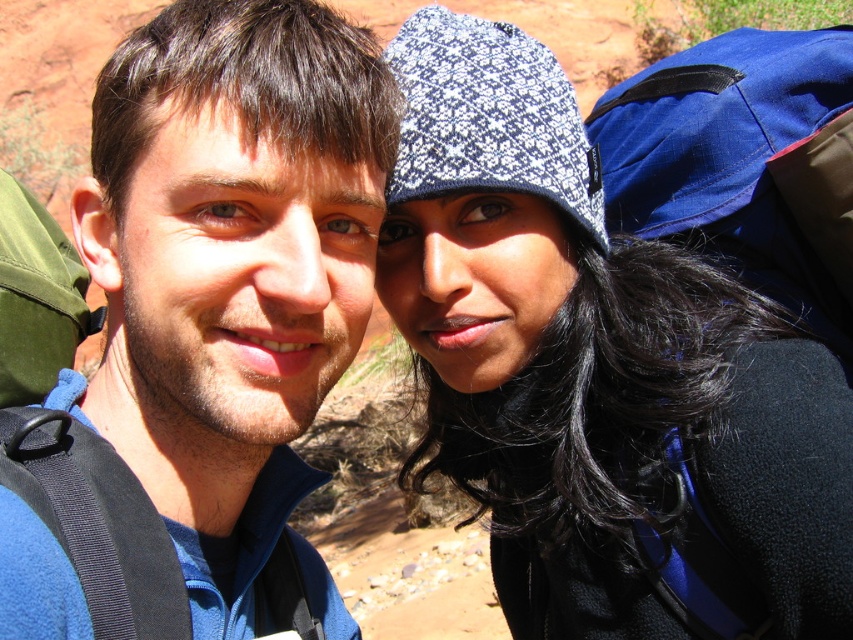
You are a photographer trying to capture a photo of both individuals in the scene. You notice two specific points marked in the image. The first point is at coordinate point[254,486] and the second at point[825,115]. To ensure both people are in focus, you need to determine which point is closer to the camera. Which point should you focus on?

Point[254,486] is in front of point[825,115], so you should focus on point[254,486] to ensure both individuals are in focus.

You are planning to buy a jacket and a backpack for your upcoming desert hike. You see the blue fleece jacket at left and the blue ripstop backpack at upper right in the image. Which item is smaller in size?

The blue fleece jacket at left is smaller in size compared to the blue ripstop backpack at upper right.